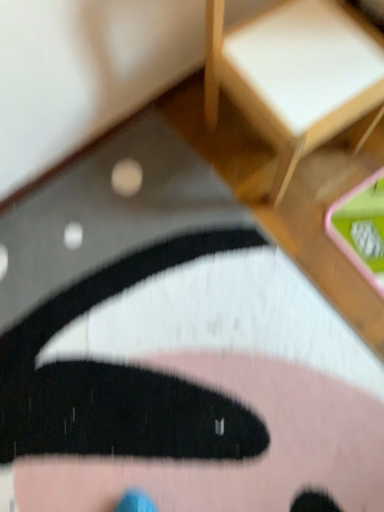
This screenshot has height=512, width=384. In order to click on vacant region under wooden stool at upper right (from a real-world perspective) in this screenshot , I will do `click(273, 147)`.